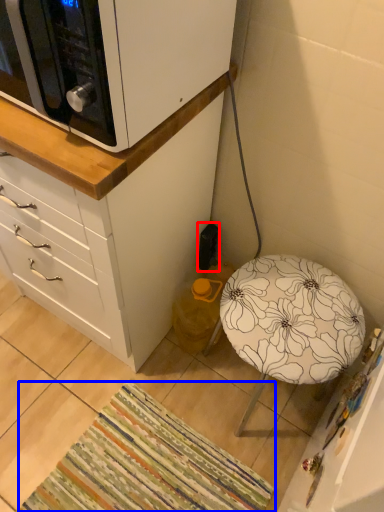
Question: Which point is closer to the camera, electric outlet (highlighted by a red box) or mat (highlighted by a blue box)?

Choices:
 (A) electric outlet
 (B) mat

Answer: (B)